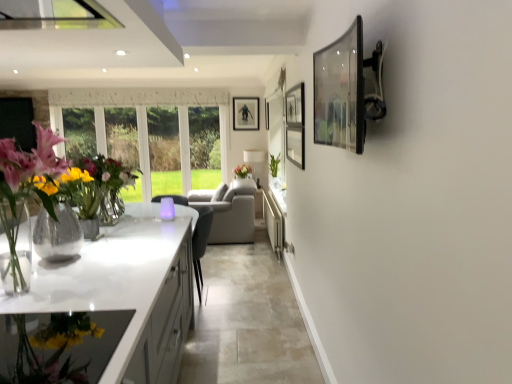
Question: Considering the positions of white glossy countertop at lower left and clear glass picture frame at upper right, acting as the 3th picture frame starting from the top, in the image, is white glossy countertop at lower left taller or shorter than clear glass picture frame at upper right, acting as the 3th picture frame starting from the top,?

Choices:
 (A) tall
 (B) short

Answer: (B)

Question: Visually, is white glossy countertop at lower left positioned to the left or to the right of clear glass picture frame at upper right, placed as the third picture frame when sorted from back to front?

Choices:
 (A) left
 (B) right

Answer: (A)

Question: Which object is the farthest from the clear glass picture frame at upper right, acting as the 3th picture frame starting from the top?

Choices:
 (A) green glossy plant at center
 (B) white glossy cabinetry at center
 (C) pink matte flower at center
 (D) white glossy countertop at lower left
 (E) translucent glass vase at left

Answer: (C)

Question: Which is nearer to the translucent glass vase at left?

Choices:
 (A) green glossy plant at center
 (B) matte black picture frame at upper center, which is the second picture frame in top-to-bottom order
 (C) matte black picture frame at upper center, which ranks as the first picture frame in left-to-right order
 (D) clear glass picture frame at upper right, the 3th picture frame viewed from the left
 (E) pink matte flower at center

Answer: (D)